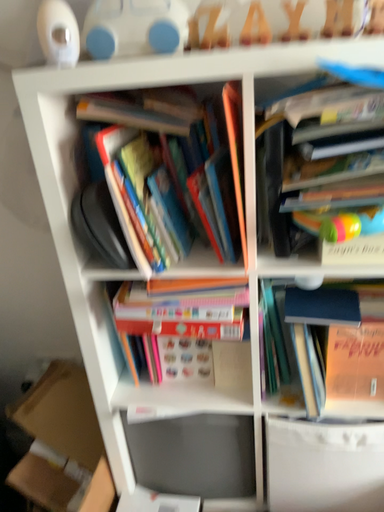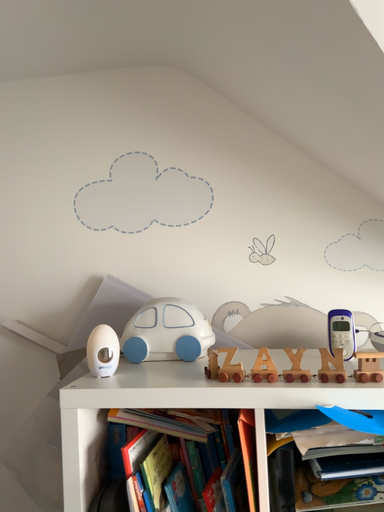
Question: Which way did the camera rotate in the video?

Choices:
 (A) rotated upward
 (B) rotated downward

Answer: (A)